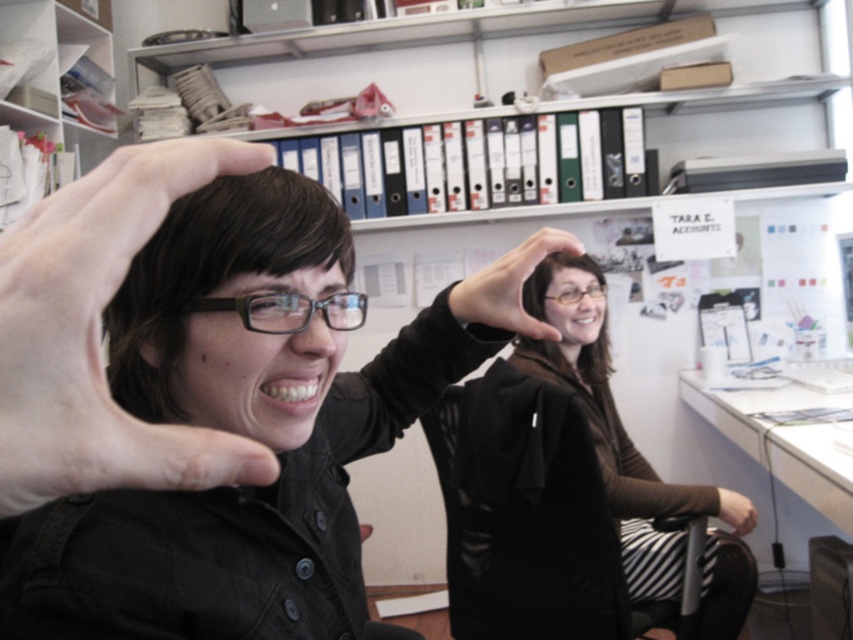
You are a delivery person who needs to place a package between the matte black glasses at center and the clear plastic glasses at center. The package is 4 feet long. Can you fit it between them?

The distance between the matte black glasses at center and the clear plastic glasses at center is 3.97 feet. Since the package is 4 feet long, it is slightly longer than the available space. Therefore, the package cannot be placed between them without overlapping.

In the scene shown: You are an artist trying to draw the scene. You notice two hands in the image. Which hand is taller between the skinny white hand at left and the black matte hand at center?

The skinny white hand at left is taller than the black matte hand at center.